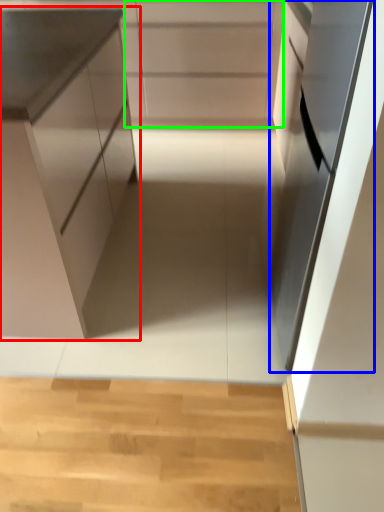
Question: Which object is the farthest from cabinetry (highlighted by a red box)? Choose among these: oven (highlighted by a blue box) or cabinetry (highlighted by a green box).

Choices:
 (A) oven
 (B) cabinetry

Answer: (B)